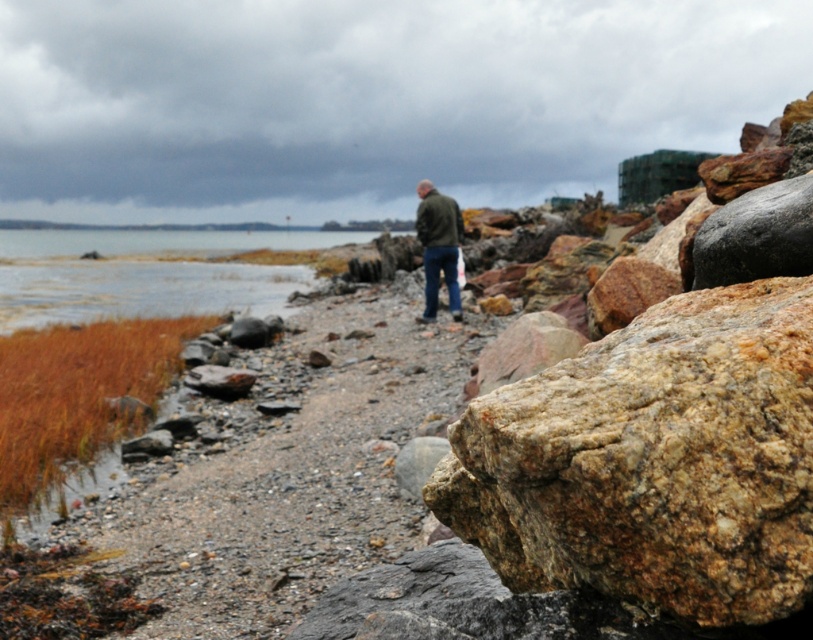
Question: Considering the real-world distances, which object is farthest from the clear water at lower left?

Choices:
 (A) dull gray gravel at center
 (B) green matte jacket at center

Answer: (B)

Question: Does clear water at lower left appear on the left side of green matte jacket at center?

Choices:
 (A) no
 (B) yes

Answer: (B)

Question: Does dull gray gravel at center lie behind green matte jacket at center?

Choices:
 (A) yes
 (B) no

Answer: (B)

Question: Can you confirm if dull gray gravel at center is positioned to the left of clear water at lower left?

Choices:
 (A) yes
 (B) no

Answer: (B)

Question: Among these points, which one is farthest from the camera?

Choices:
 (A) (272, 588)
 (B) (266, 272)
 (C) (431, 259)

Answer: (B)

Question: Which point is farther to the camera?

Choices:
 (A) (437, 282)
 (B) (222, 634)

Answer: (A)